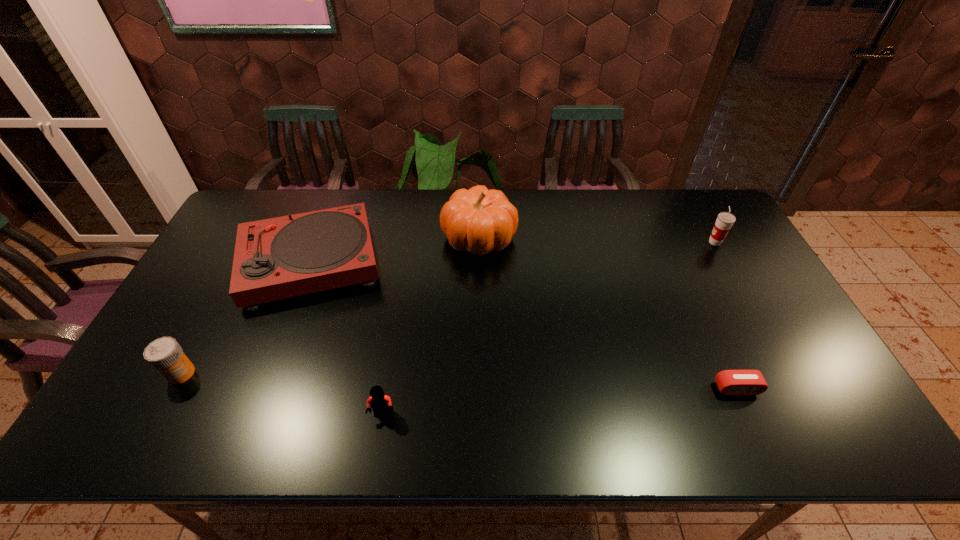
Locate an element on the screen. blank region between the medicine and the fifth shortest object is located at coordinates (448, 308).

You are a GUI agent. You are given a task and a screenshot of the screen. Output one action in this format:
    pyautogui.click(x=<x>, y=<y>)
    Task: Click on the free spot between the pumpkin and the shortest object
    
    Given the screenshot: What is the action you would take?
    pyautogui.click(x=608, y=313)

Locate which object ranks fifth in proximity to the Lego. Please provide its 2D coordinates. Your answer should be formatted as a tuple, i.e. [(x, y)], where the tuple contains the x and y coordinates of a point satisfying the conditions above.

[(725, 220)]

Where is `the third closest object to the rightmost object`? The image size is (960, 540). the third closest object to the rightmost object is located at coordinates (283, 257).